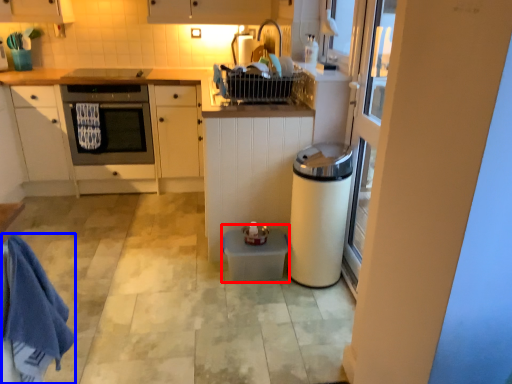
Question: Which object is further to the camera taking this photo, water heater (highlighted by a red box) or bath towel (highlighted by a blue box)?

Choices:
 (A) water heater
 (B) bath towel

Answer: (A)